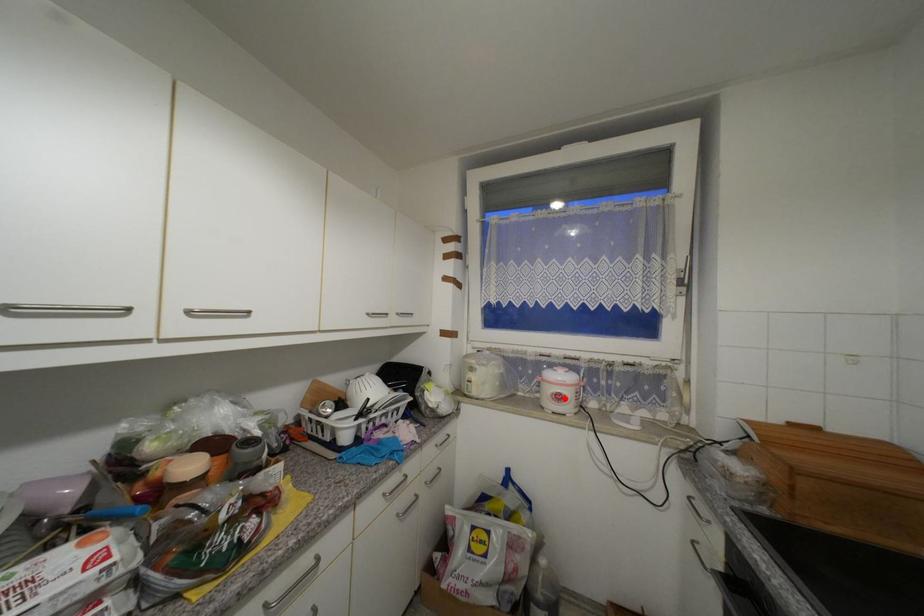
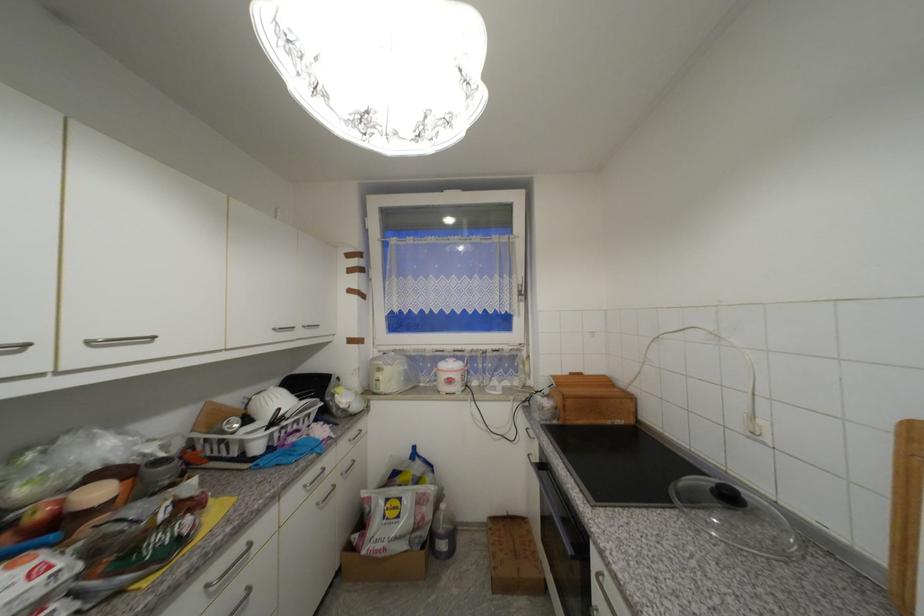
Where in the second image is the point corresponding to the highlighted location from the first image?

(456, 382)